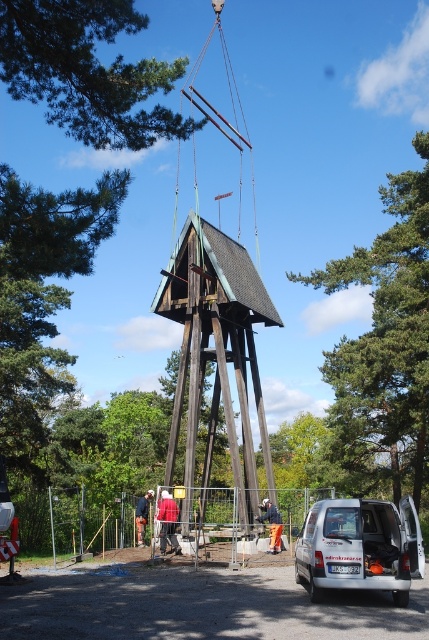
Between dark brown wooden bell tower at center and white matte van at lower right, which one has less height?

With less height is white matte van at lower right.

Is the position of dark brown wooden bell tower at center more distant than that of white matte van at lower right?

Yes, dark brown wooden bell tower at center is behind white matte van at lower right.

Which is in front, point (184, 387) or point (362, 588)?

Point (362, 588) is more forward.

Image resolution: width=429 pixels, height=640 pixels. I want to click on dark brown wooden bell tower at center, so click(217, 349).

Can you confirm if dark brown wooden bell tower at center is positioned above orange fabric at center?

Yes.

How distant is dark brown wooden bell tower at center from orange fabric at center?

The distance of dark brown wooden bell tower at center from orange fabric at center is 5.92 meters.

At what (x,y) coordinates should I click in order to perform the action: click on dark brown wooden bell tower at center. Please return your answer as a coordinate pair (x, y). The height and width of the screenshot is (640, 429). Looking at the image, I should click on pos(217,349).

Where is `dark brown wooden bell tower at center`? The image size is (429, 640). dark brown wooden bell tower at center is located at coordinates (217, 349).

Can you confirm if white matte van at lower right is bigger than orange fabric at center?

Correct, white matte van at lower right is larger in size than orange fabric at center.

Can you confirm if white matte van at lower right is positioned to the left of orange fabric at center?

In fact, white matte van at lower right is to the right of orange fabric at center.

Does point (392, 576) come closer to viewer compared to point (268, 516)?

Yes, it is in front of point (268, 516).

Where is `white matte van at lower right`? white matte van at lower right is located at coordinates (359, 547).